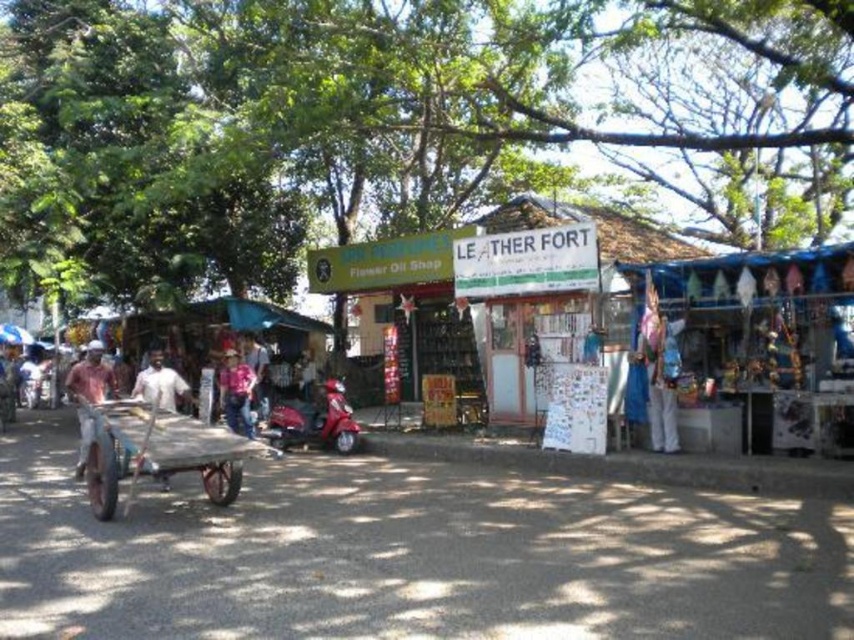
Which is behind, point (145, 452) or point (77, 380)?

The point (77, 380) is behind.

Does wooden cart at center appear under reddish-brown fabric shirt at left?

Yes, wooden cart at center is below reddish-brown fabric shirt at left.

Where is `wooden cart at center`? The image size is (854, 640). wooden cart at center is located at coordinates (159, 452).

In the scene shown: Does wooden cart at center have a lesser height compared to white matte shirt at center?

No, wooden cart at center is not shorter than white matte shirt at center.

Where is `wooden cart at center`? The height and width of the screenshot is (640, 854). wooden cart at center is located at coordinates (159, 452).

At what (x,y) coordinates should I click in order to perform the action: click on wooden cart at center. Please return your answer as a coordinate pair (x, y). Looking at the image, I should click on (159, 452).

Can you confirm if shiny red motorcycle at center is thinner than pink cotton shirt at center?

No.

Who is positioned more to the right, shiny red motorcycle at center or pink cotton shirt at center?

shiny red motorcycle at center is more to the right.

Does point (297, 404) come closer to viewer compared to point (237, 397)?

No.

This screenshot has width=854, height=640. In order to click on shiny red motorcycle at center in this screenshot , I will do `click(314, 420)`.